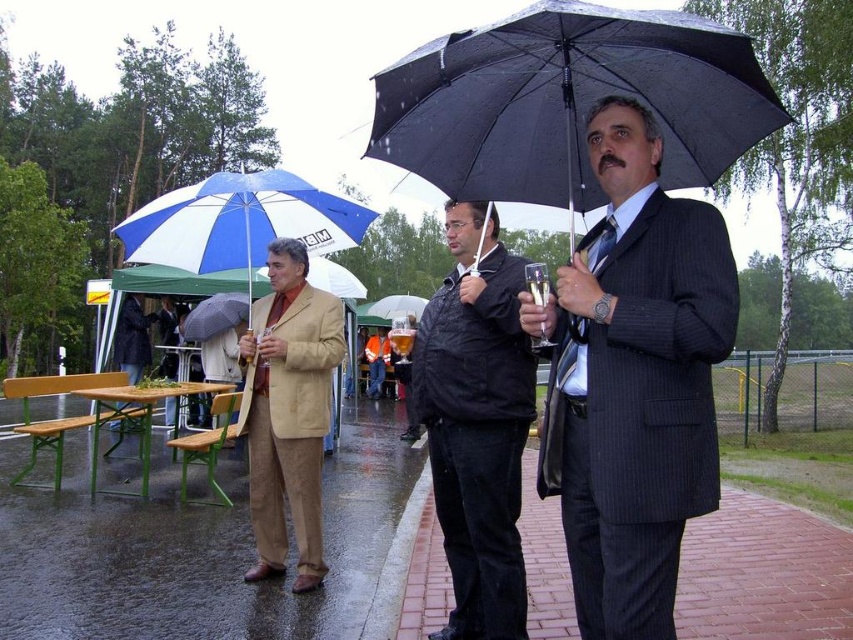
You are a photographer trying to capture a clear shot of both the black matte umbrella at center and the transparent plastic umbrella at center. Since you want both to be in focus, which umbrella should you adjust your camera focus on first?

The black matte umbrella at center is closer to the viewer than the transparent plastic umbrella at center. To ensure both are in focus, you should focus on the black matte umbrella at center first, as it is the closer object.

You are standing at the point marked as point (581, 40) in the image. You want to walk to the nearest sheltered area, which is a covered pavilion located 5 meters away from your current position. Can you safely walk from your current position to the pavilion without getting wet if it starts raining again?

The distance between point (581, 40) and the viewer is 2.65 meters. However, the pavilion is 5 meters away. Since the pavilion is farther than the distance from the point to the viewer, you may get wet while walking to the pavilion if it starts raining again.

You are a fashion designer observing the scene and notice the matte black suit at center and the black matte jacket at center. Which one has a shorter length?

The matte black suit at center is shorter than the black matte jacket at center.